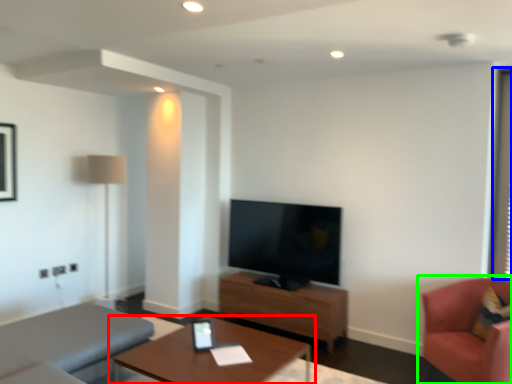
Question: Which is farther away from table (highlighted by a red box)? window screen (highlighted by a blue box) or chair (highlighted by a green box)?

Choices:
 (A) window screen
 (B) chair

Answer: (A)